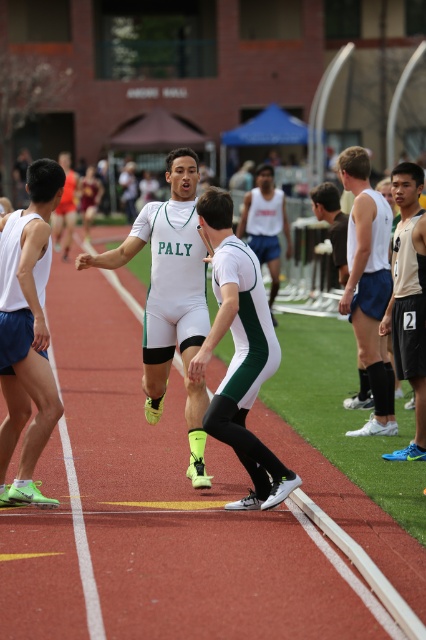
Question: Is matte white shorts at right further to the viewer compared to tan jersey at right?

Choices:
 (A) no
 (B) yes

Answer: (B)

Question: Which point is farther to the camera?

Choices:
 (A) white matte athletic uniform at center
 (B) white tank top at center
 (C) matte white shorts at left
 (D) matte white shorts at right

Answer: (B)

Question: Which object appears farthest from the camera in this image?

Choices:
 (A) tan jersey at right
 (B) white matte uniform at center

Answer: (A)

Question: Can you confirm if white matte uniform at center is positioned to the right of white matte athletic uniform at center?

Choices:
 (A) no
 (B) yes

Answer: (A)

Question: Which point is farther from the camera taking this photo?

Choices:
 (A) (256, 506)
 (B) (34, 429)
 (C) (264, 221)
 (D) (382, 282)

Answer: (C)

Question: Is matte white shorts at left above white matte athletic uniform at center?

Choices:
 (A) no
 (B) yes

Answer: (B)